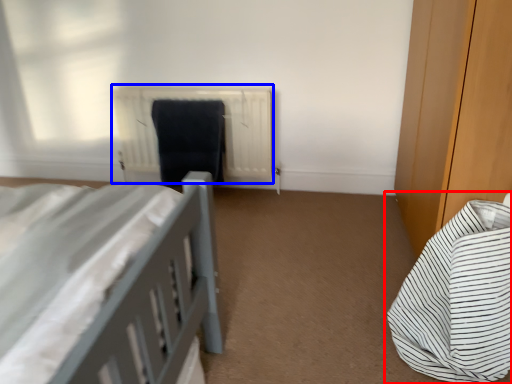
Question: Which object is further to the camera taking this photo, bed (highlighted by a red box) or radiator (highlighted by a blue box)?

Choices:
 (A) bed
 (B) radiator

Answer: (B)